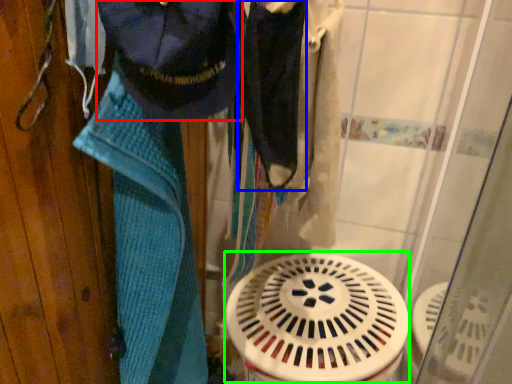
Question: Based on their relative distances, which object is nearer to clothing (highlighted by a red box)? Choose from clothing (highlighted by a blue box) and water heater (highlighted by a green box).

Choices:
 (A) clothing
 (B) water heater

Answer: (A)